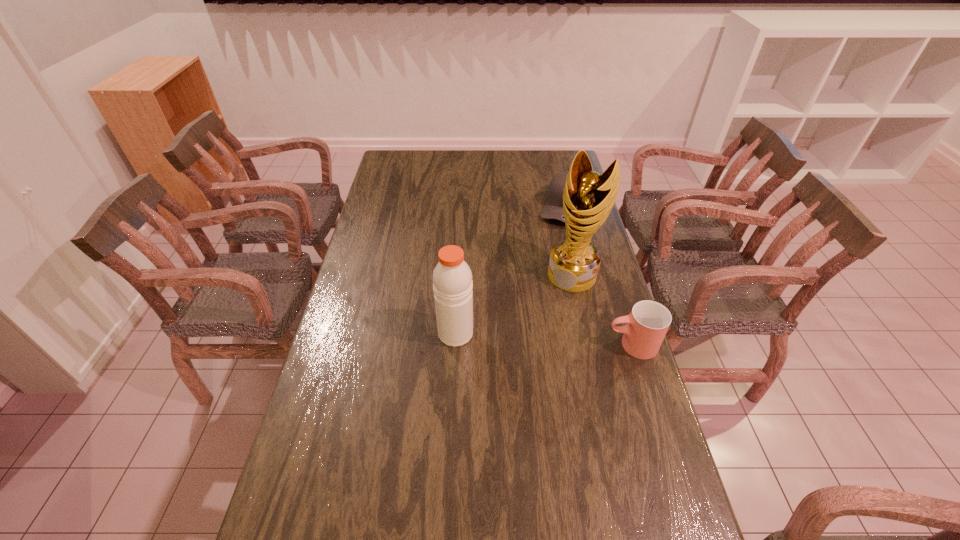
I want to click on shaker, so click(x=452, y=279).

Where is `the leftmost object`? Image resolution: width=960 pixels, height=540 pixels. the leftmost object is located at coordinates (452, 279).

You are a GUI agent. You are given a task and a screenshot of the screen. Output one action in this format:
    pyautogui.click(x=<x>, y=<y>)
    Task: Click on the cup
    
    Given the screenshot: What is the action you would take?
    pyautogui.click(x=647, y=324)

At what (x,y) coordinates should I click in order to perform the action: click on award. Please return your answer as a coordinate pair (x, y). Looking at the image, I should click on (588, 197).

The height and width of the screenshot is (540, 960). In order to click on the tallest object in this screenshot , I will do `click(588, 197)`.

The image size is (960, 540). I want to click on the farthest object, so click(x=553, y=209).

Where is `vacant space situated on the right of the shaker`? The width and height of the screenshot is (960, 540). vacant space situated on the right of the shaker is located at coordinates (544, 334).

Where is `vacant area situated 0.210m on the side of the cup with the handle`? The height and width of the screenshot is (540, 960). vacant area situated 0.210m on the side of the cup with the handle is located at coordinates (537, 345).

Find the location of `vacant space located 0.400m on the side of the cup with the handle`. vacant space located 0.400m on the side of the cup with the handle is located at coordinates (474, 345).

This screenshot has height=540, width=960. Identify the location of vacant space situated on the side of the cup with the handle. (511, 345).